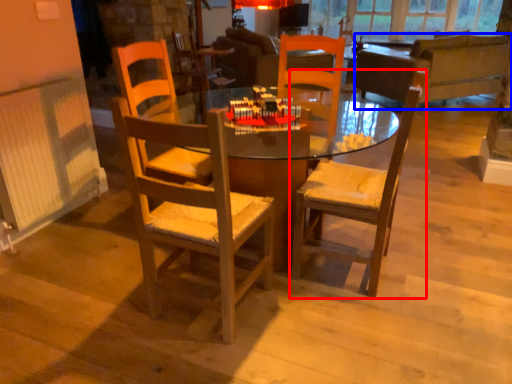
Question: Which of the following is the farthest to the observer, chair (highlighted by a red box) or studio couch (highlighted by a blue box)?

Choices:
 (A) chair
 (B) studio couch

Answer: (B)